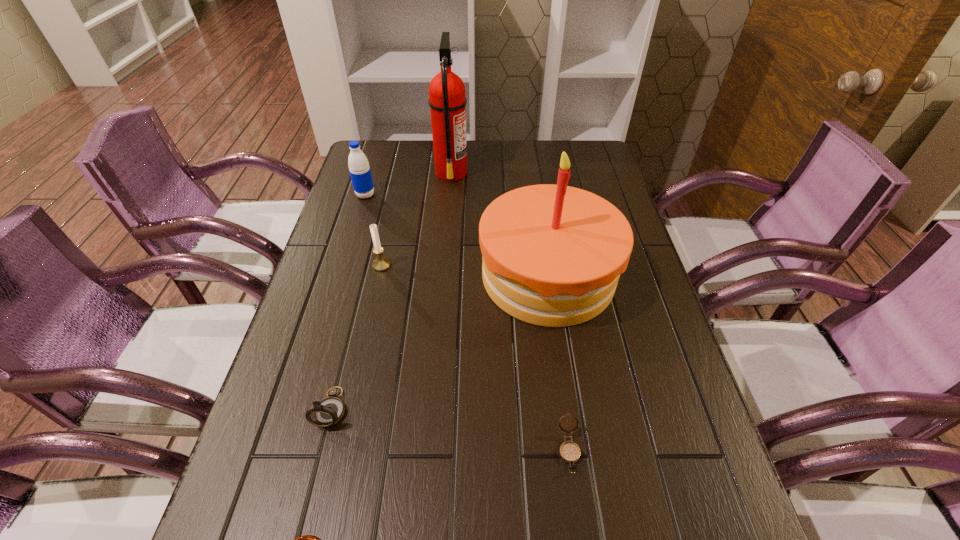
Identify the location of free spot between the second tallest object and the second tallest compass. The width and height of the screenshot is (960, 540). (559, 362).

Locate which object ranks fifth in proximity to the birthday cake. Please provide its 2D coordinates. Your answer should be formatted as a tuple, i.e. [(x, y)], where the tuple contains the x and y coordinates of a point satisfying the conditions above.

[(358, 164)]

Select which object is the fifth closest to the candle holder. Please provide its 2D coordinates. Your answer should be formatted as a tuple, i.e. [(x, y)], where the tuple contains the x and y coordinates of a point satisfying the conditions above.

[(569, 451)]

Select which compass is the second closest to the sixth tallest object. Please provide its 2D coordinates. Your answer should be formatted as a tuple, i.e. [(x, y)], where the tuple contains the x and y coordinates of a point satisfying the conditions above.

[(329, 411)]

Locate an element on the screen. compass that can be found as the third closest to the candle holder is located at coordinates (306, 539).

Identify the location of vacant region that satisfies the following two spatial constraints: 1. on the side of the third object from right to left near the handle; 2. on the back side of the sixth shortest object. This screenshot has width=960, height=540. (443, 275).

What are the coordinates of `vacant space that satisfies the following two spatial constraints: 1. on the side of the third object from right to left near the handle; 2. on the left side of the second tallest object` in the screenshot? It's located at (443, 275).